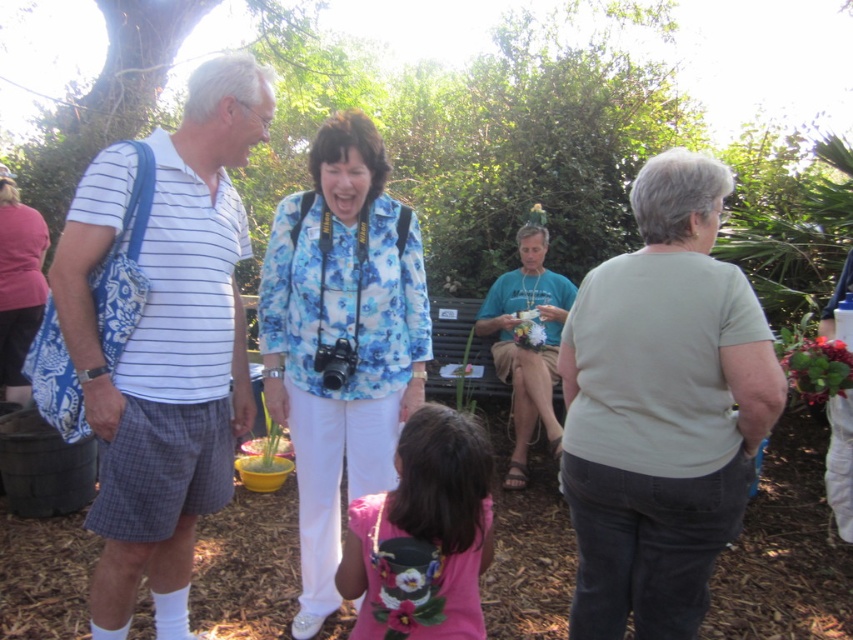
Between point (763, 337) and point (310, 536), which one is positioned in front?

Point (763, 337) is more forward.

Does light gray cotton shirt at center have a greater width compared to floral fabric shirt at center?

In fact, light gray cotton shirt at center might be narrower than floral fabric shirt at center.

Looking at this image, who is more forward, [750,369] or [381,468]?

Point [750,369] is more forward.

Find the location of a particular element. This screenshot has width=853, height=640. light gray cotton shirt at center is located at coordinates (662, 408).

Does light gray cotton shirt at center have a smaller size compared to white striped shirt at left?

Yes, light gray cotton shirt at center is smaller than white striped shirt at left.

Does point (677, 608) come farther from viewer compared to point (231, 58)?

No, it is in front of (231, 58).

Locate an element on the screen. The height and width of the screenshot is (640, 853). light gray cotton shirt at center is located at coordinates (662, 408).

Is point (329, 550) behind point (554, 368)?

No, it is not.

Can you confirm if floral fabric shirt at center is positioned below blue floral shirt at center?

Actually, floral fabric shirt at center is above blue floral shirt at center.

At what (x,y) coordinates should I click in order to perform the action: click on floral fabric shirt at center. Please return your answer as a coordinate pair (x, y). This screenshot has width=853, height=640. Looking at the image, I should click on click(x=341, y=339).

What are the coordinates of `floral fabric shirt at center` in the screenshot? It's located at (341, 339).